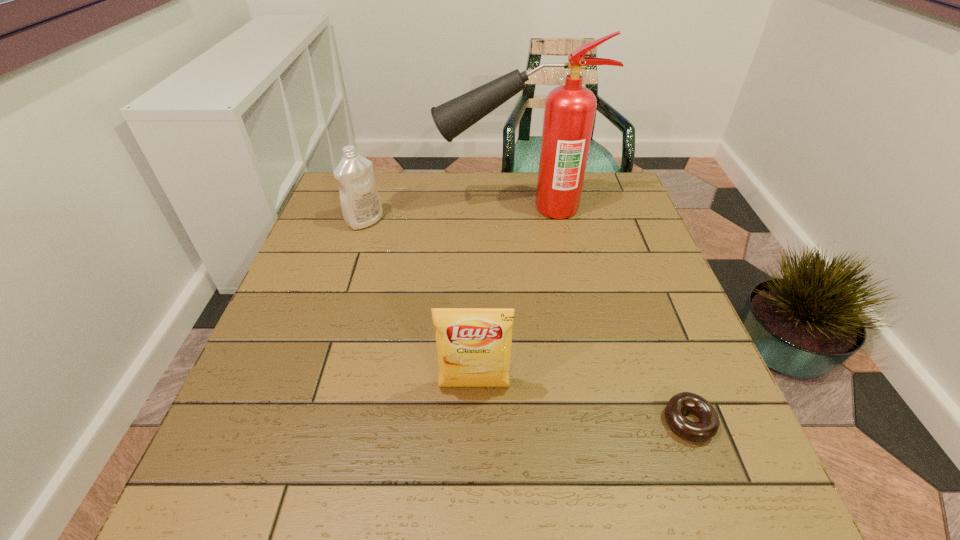
Identify the location of free space that satisfies the following two spatial constraints: 1. at the nozzle of the tallest object; 2. on the left side of the nearest object. This screenshot has width=960, height=540. (539, 422).

Locate an element on the screen. Image resolution: width=960 pixels, height=540 pixels. free location that satisfies the following two spatial constraints: 1. at the nozzle of the tallest object; 2. on the front of the crisp (potato chip) with the logo is located at coordinates (535, 387).